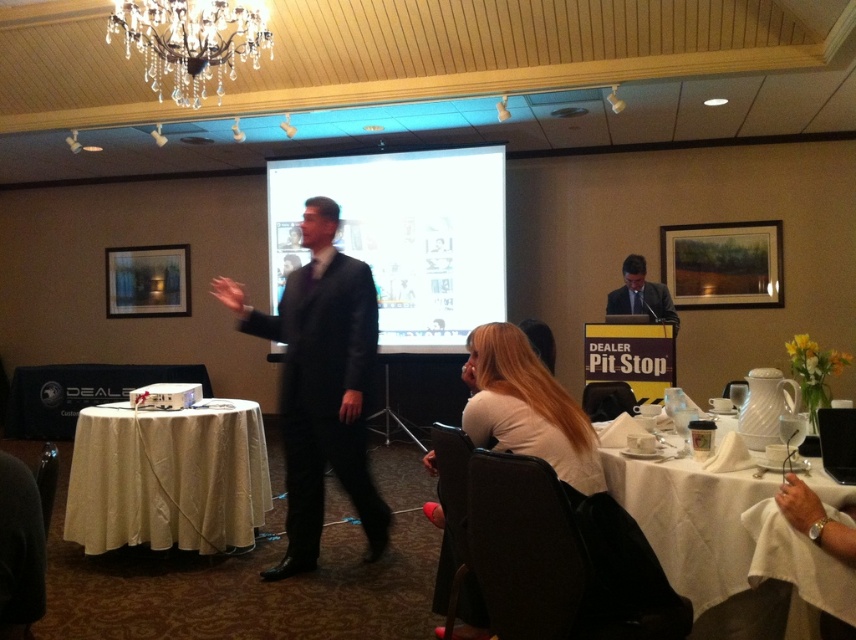
Question: Based on their relative distances, which object is farther from the matte black suit at center?

Choices:
 (A) white glossy projection screen at center
 (B) black suit at center
 (C) crystal glass chandelier at upper center

Answer: (C)

Question: Can you confirm if white glossy projection screen at center is wider than white plastic projector at lower left?

Choices:
 (A) no
 (B) yes

Answer: (B)

Question: Which of the following is the farthest from the observer?

Choices:
 (A) white matte shirt at lower center
 (B) white plastic projector at lower left

Answer: (B)

Question: Does black suit at center appear under white plastic projector at lower left?

Choices:
 (A) no
 (B) yes

Answer: (A)

Question: In this image, where is white matte shirt at lower center located relative to matte black suit at center?

Choices:
 (A) below
 (B) above

Answer: (A)

Question: Estimate the real-world distances between objects in this image. Which object is closer to the white matte shirt at lower center?

Choices:
 (A) white cloth-covered table at lower right
 (B) crystal glass chandelier at upper center
 (C) white cloth-covered table at lower left
 (D) white glossy projection screen at center

Answer: (A)